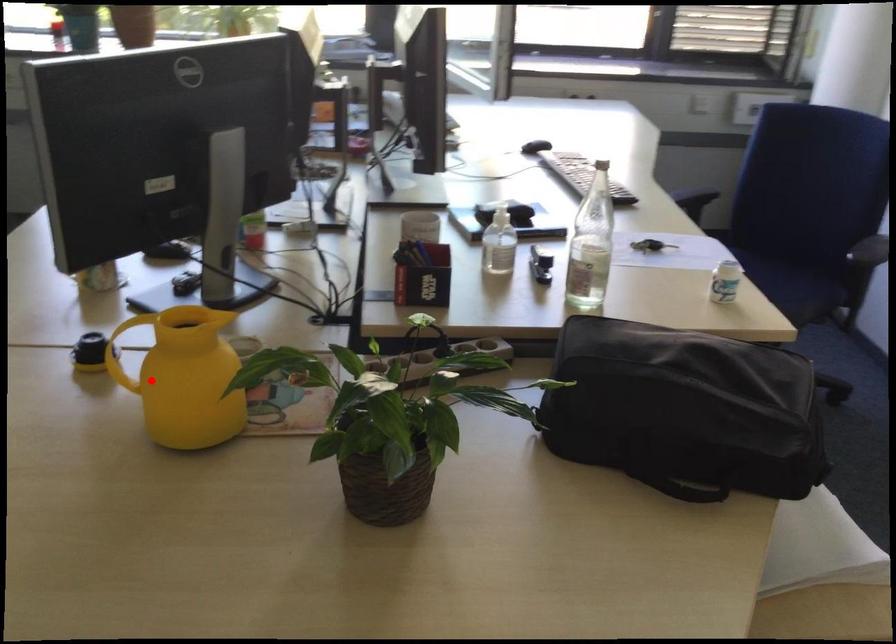
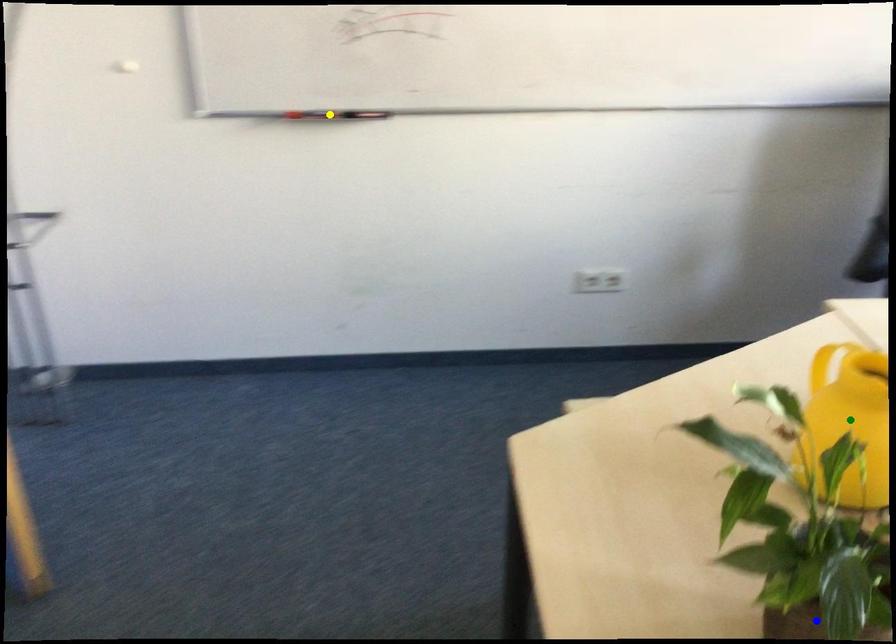
Question: I am providing you with two images of the same scene from different viewpoints. A red point is marked on the first image. You are given multiple points on the second image. Which mark in image 2 goes with the point in image 1?

Choices:
 (A) green point
 (B) yellow point
 (C) blue point

Answer: (A)